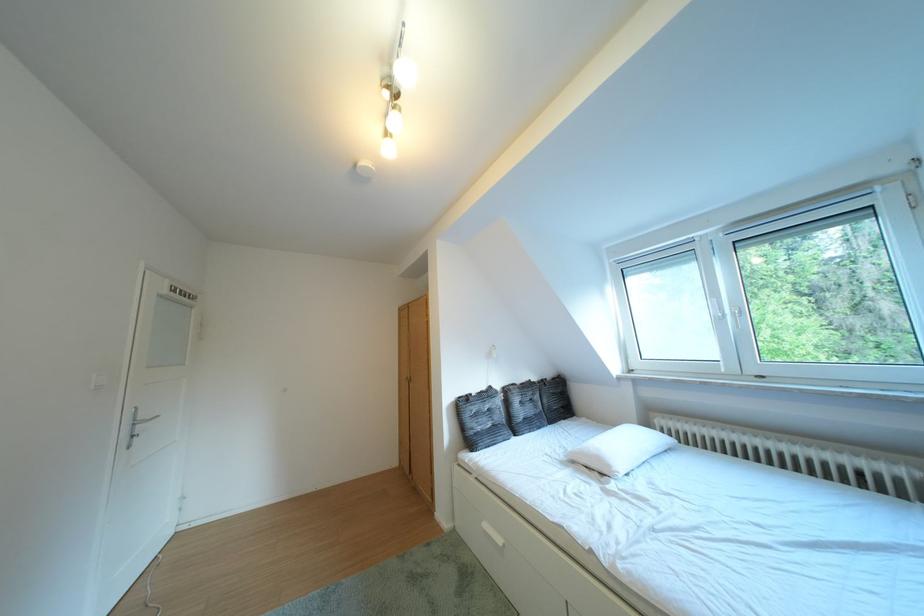
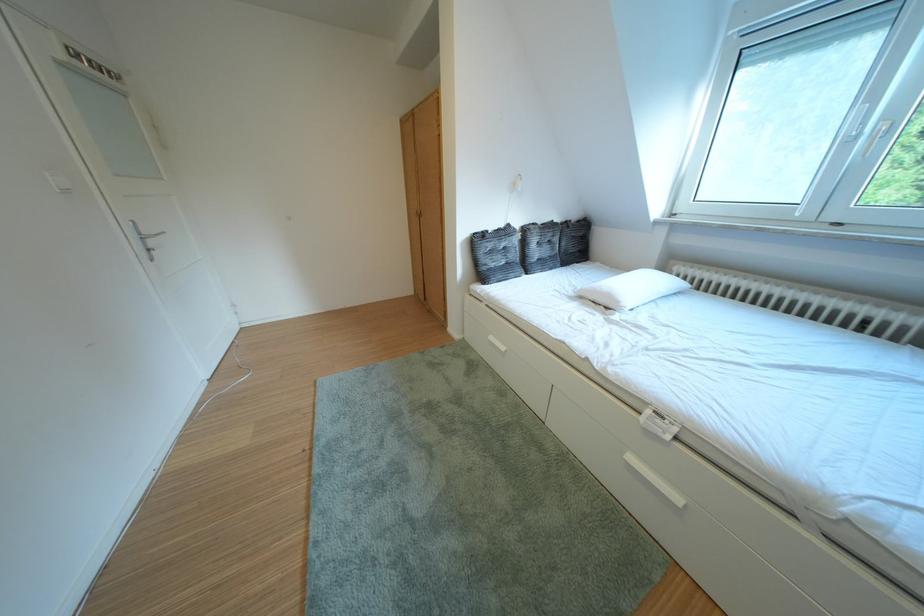
Find the pixel in the second image that matches pixel 503 541 in the first image.

(506, 350)